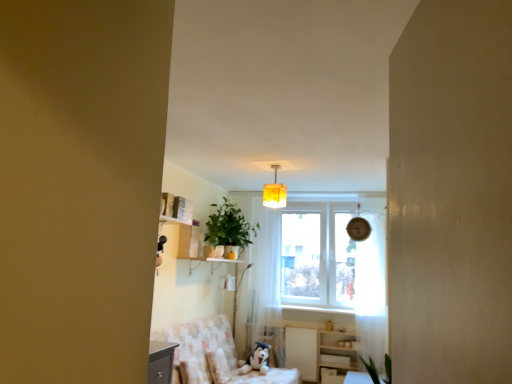
What do you see at coordinates (212, 353) in the screenshot?
I see `fluffy fabric swivel chair at lower center` at bounding box center [212, 353].

This screenshot has width=512, height=384. I want to click on white glossy dresser at lower right, so point(337,351).

The width and height of the screenshot is (512, 384). Describe the element at coordinates (229, 228) in the screenshot. I see `green matte plant at center` at that location.

The width and height of the screenshot is (512, 384). In order to click on wooden table at lower right in this screenshot , I will do `click(357, 378)`.

From the picture: Is green matte plant at center facing away from yellow fabric lampshade at center?

No, green matte plant at center is not facing away from yellow fabric lampshade at center.

Is green matte plant at center inside the boundaries of yellow fabric lampshade at center, or outside?

The correct answer is: outside.

Considering the sizes of green matte plant at center and yellow fabric lampshade at center in the image, is green matte plant at center bigger or smaller than yellow fabric lampshade at center?

Considering their sizes, green matte plant at center takes up more space than yellow fabric lampshade at center.

Considering the positions of objects green matte plant at center and yellow fabric lampshade at center in the image provided, who is more to the right, green matte plant at center or yellow fabric lampshade at center?

yellow fabric lampshade at center is more to the right.

Is wooden table at lower right in front of or behind yellow fabric lampshade at center in the image?

Clearly, wooden table at lower right is behind yellow fabric lampshade at center.

Between wooden table at lower right and yellow fabric lampshade at center, which one has more height?

Standing taller between the two is yellow fabric lampshade at center.

From a real-world perspective, between wooden table at lower right and yellow fabric lampshade at center, who is vertically lower?

wooden table at lower right is physically lower.

Is wooden table at lower right oriented towards yellow fabric lampshade at center?

No.

How many degrees apart are the facing directions of white sheer curtain at center, positioned as the first curtain in back-to-front order, and green matte plant at center?

They differ by 94.9 degrees in their facing directions.

Looking at this image, is green matte plant at center inside white sheer curtain at center, positioned as the first curtain in back-to-front order?

No.

Is point (267, 304) closer or farther from the camera than point (256, 229)?

Point (267, 304).

The image size is (512, 384). I want to click on houseplant lying above the white sheer curtain at center, positioned as the first curtain in back-to-front order (from the image's perspective), so click(229, 228).

I want to click on pillow lying below the yellow fabric lampshade at center (from the image's perspective), so click(218, 366).

From the image's perspective, is yellow fabric lampshade at center positioned above or below fluffy white pillow at lower center?

From the image's perspective, yellow fabric lampshade at center appears above fluffy white pillow at lower center.

Which point is more forward, (268, 193) or (271, 219)?

Positioned in front is point (268, 193).

Considering the sizes of objects yellow fabric lampshade at center and white sheer curtain at center, the 2th curtain when ordered from right to left, in the image provided, who is taller, yellow fabric lampshade at center or white sheer curtain at center, the 2th curtain when ordered from right to left,?

Standing taller between the two is white sheer curtain at center, the 2th curtain when ordered from right to left.

From the image's perspective, which is above, yellow fabric lampshade at center or white sheer curtain at center, positioned as the first curtain in back-to-front order?

yellow fabric lampshade at center, from the image's perspective.

Is yellow fabric lampshade at center bigger than white sheer curtain at center, the 2th curtain when ordered from right to left?

No, yellow fabric lampshade at center is not bigger than white sheer curtain at center, the 2th curtain when ordered from right to left.

Is yellow fabric lampshade at center oriented towards white glossy dresser at lower right?

No, yellow fabric lampshade at center does not turn towards white glossy dresser at lower right.

From the image's perspective, is yellow fabric lampshade at center located beneath white glossy dresser at lower right?

No, from the image's perspective, yellow fabric lampshade at center is not below white glossy dresser at lower right.

Looking at their sizes, would you say yellow fabric lampshade at center is wider or thinner than white glossy dresser at lower right?

Considering their sizes, yellow fabric lampshade at center looks broader than white glossy dresser at lower right.

Is fluffy white pillow at lower center thinner than white sheer curtain at center, positioned as the first curtain in back-to-front order?

Indeed, fluffy white pillow at lower center has a lesser width compared to white sheer curtain at center, positioned as the first curtain in back-to-front order.

Is fluffy white pillow at lower center at the left side of white sheer curtain at center, which appears as the first curtain when viewed from the left?

Yes, fluffy white pillow at lower center is to the left of white sheer curtain at center, which appears as the first curtain when viewed from the left.

Is fluffy white pillow at lower center turned away from white sheer curtain at center, the 2th curtain when ordered from right to left?

That's not correct — fluffy white pillow at lower center is not looking away from white sheer curtain at center, the 2th curtain when ordered from right to left.

Is fluffy white pillow at lower center completely or partially outside of white sheer curtain at center, the 2th curtain when ordered from right to left?

Yes, fluffy white pillow at lower center is not within white sheer curtain at center, the 2th curtain when ordered from right to left.

The width and height of the screenshot is (512, 384). I want to click on light fixture located above the green matte plant at center (from the image's perspective), so click(x=275, y=192).

You are a GUI agent. You are given a task and a screenshot of the screen. Output one action in this format:
    pyautogui.click(x=<x>, y=<y>)
    Task: Click on the table below the yellow fabric lampshade at center (from a real-world perspective)
    The image size is (512, 384).
    Given the screenshot: What is the action you would take?
    pyautogui.click(x=357, y=378)

Considering their positions, is fluffy white pillow at lower center positioned closer to fluffy fabric swivel chair at lower center than white sheer curtain at right, which appears as the first curtain when viewed from the right?

The object closer to fluffy fabric swivel chair at lower center is fluffy white pillow at lower center.

When comparing their distances from white sheer curtain at center, positioned as the first curtain in back-to-front order, does fluffy white pillow at lower center or wooden table at lower right seem further?

wooden table at lower right is further to white sheer curtain at center, positioned as the first curtain in back-to-front order.

In the scene shown: When comparing their distances from fluffy white pillow at lower center, does green matte plant at center or wooden table at lower right seem further?

Among the two, wooden table at lower right is located further to fluffy white pillow at lower center.

From the image, which object appears to be nearer to white sheer curtain at right, which appears as the second curtain when viewed from the left, fluffy fabric swivel chair at lower center or white sheer curtain at center, which is the 2th curtain in front-to-back order?

white sheer curtain at center, which is the 2th curtain in front-to-back order, is closer to white sheer curtain at right, which appears as the second curtain when viewed from the left.

Based on their spatial positions, is white sheer curtain at right, which appears as the second curtain when viewed from the left, or white glossy dresser at lower right closer to white sheer curtain at center, which is the 2th curtain in front-to-back order?

white glossy dresser at lower right.

Looking at the image, which one is located further to fluffy white pillow at lower center, wooden table at lower right or fluffy fabric swivel chair at lower center?

wooden table at lower right.

Looking at the image, which one is located further to wooden table at lower right, white sheer curtain at center, positioned as the first curtain in back-to-front order, or white glossy dresser at lower right?

white sheer curtain at center, positioned as the first curtain in back-to-front order.

Estimate the real-world distances between objects in this image. Which object is further from wooden table at lower right, fluffy fabric swivel chair at lower center or green matte plant at center?

Among the two, green matte plant at center is located further to wooden table at lower right.

This screenshot has width=512, height=384. What are the coordinates of `houseplant located between fluffy white pillow at lower center and wooden table at lower right in the left-right direction` in the screenshot? It's located at (229, 228).

The height and width of the screenshot is (384, 512). Identify the location of houseplant between yellow fabric lampshade at center and white glossy dresser at lower right vertically. point(229,228).

You are a GUI agent. You are given a task and a screenshot of the screen. Output one action in this format:
    pyautogui.click(x=<x>, y=<y>)
    Task: Click on the houseplant between yellow fabric lampshade at center and fluffy fabric swivel chair at lower center vertically
    The image size is (512, 384).
    Given the screenshot: What is the action you would take?
    pyautogui.click(x=229, y=228)

Identify the location of swivel chair between yellow fabric lampshade at center and wooden table at lower right in the vertical direction. The image size is (512, 384). (212, 353).